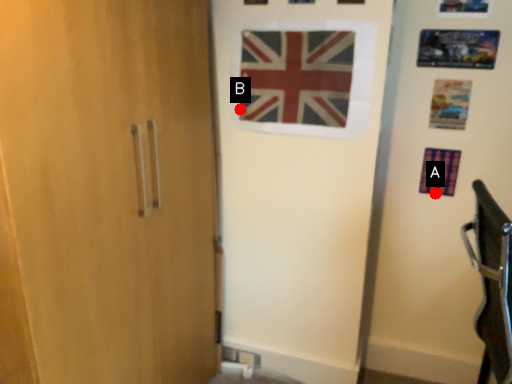
Question: Two points are circled on the image, labeled by A and B beside each circle. Which point appears farthest from the camera in this image?

Choices:
 (A) A is further
 (B) B is further

Answer: (A)